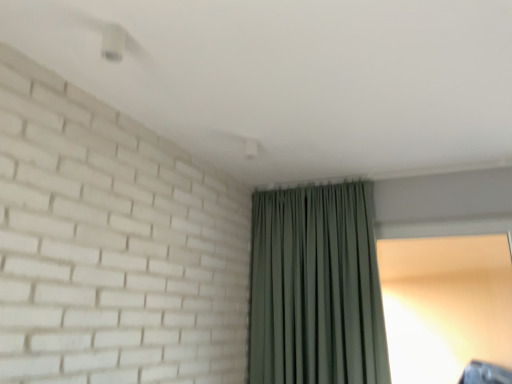
Where is `transparent glass window at right`? Image resolution: width=512 pixels, height=384 pixels. transparent glass window at right is located at coordinates (446, 305).

What do you see at coordinates (446, 305) in the screenshot?
I see `transparent glass window at right` at bounding box center [446, 305].

Image resolution: width=512 pixels, height=384 pixels. What do you see at coordinates (316, 288) in the screenshot?
I see `green fabric curtain at center` at bounding box center [316, 288].

You are a GUI agent. You are given a task and a screenshot of the screen. Output one action in this format:
    pyautogui.click(x=<x>, y=<y>)
    Task: Click on the green fabric curtain at center
    
    Given the screenshot: What is the action you would take?
    pyautogui.click(x=316, y=288)

This screenshot has width=512, height=384. Identify the location of transparent glass window at right. (446, 305).

Considering the positions of objects green fabric curtain at center and transparent glass window at right in the image provided, who is more to the right, green fabric curtain at center or transparent glass window at right?

transparent glass window at right is more to the right.

Is green fabric curtain at center positioned before transparent glass window at right?

Yes, green fabric curtain at center is closer to the camera.

Which is behind, point (333, 262) or point (465, 247)?

The point (465, 247) is behind.

From the image's perspective, which object appears higher, green fabric curtain at center or transparent glass window at right?

green fabric curtain at center is shown above in the image.

From a real-world perspective, is green fabric curtain at center physically below transparent glass window at right?

Actually, green fabric curtain at center is physically above transparent glass window at right in the real world.

Considering the sizes of green fabric curtain at center and transparent glass window at right in the image, is green fabric curtain at center wider or thinner than transparent glass window at right?

Considering their sizes, green fabric curtain at center looks broader than transparent glass window at right.

Is green fabric curtain at center shorter than transparent glass window at right?

In fact, green fabric curtain at center may be taller than transparent glass window at right.

Between green fabric curtain at center and transparent glass window at right, which one has larger size?

With larger size is green fabric curtain at center.

Does green fabric curtain at center contain transparent glass window at right?

Definitely not — transparent glass window at right is not inside green fabric curtain at center.

In the scene shown: Is green fabric curtain at center directly adjacent to transparent glass window at right?

green fabric curtain at center and transparent glass window at right are not in contact.

Is green fabric curtain at center looking in the opposite direction of transparent glass window at right?

No, green fabric curtain at center is not facing the opposite direction of transparent glass window at right.

How many degrees apart are the facing directions of green fabric curtain at center and transparent glass window at right?

The angle between the facing direction of green fabric curtain at center and the facing direction of transparent glass window at right is 0.631 degrees.

At what (x,y) coordinates should I click in order to perform the action: click on curtain above the transparent glass window at right (from a real-world perspective). Please return your answer as a coordinate pair (x, y). This screenshot has height=384, width=512. Looking at the image, I should click on (316, 288).

Looking at this image, which object is positioned more to the right, transparent glass window at right or green fabric curtain at center?

Positioned to the right is transparent glass window at right.

Considering the positions of objects transparent glass window at right and green fabric curtain at center in the image provided, who is in front, transparent glass window at right or green fabric curtain at center?

green fabric curtain at center.

Which is behind, point (445, 297) or point (270, 324)?

The point (270, 324) is farther from the camera.

From the image's perspective, is transparent glass window at right positioned above or below green fabric curtain at center?

transparent glass window at right is below green fabric curtain at center.

From a real-world perspective, between transparent glass window at right and green fabric curtain at center, who is vertically lower?

transparent glass window at right is physically lower.

Looking at this image, between transparent glass window at right and green fabric curtain at center, which one has smaller width?

transparent glass window at right.

In terms of height, does transparent glass window at right look taller or shorter compared to green fabric curtain at center?

Considering their sizes, transparent glass window at right has less height than green fabric curtain at center.

Who is smaller, transparent glass window at right or green fabric curtain at center?

Smaller between the two is transparent glass window at right.

Would you say transparent glass window at right is outside green fabric curtain at center?

Yes, transparent glass window at right is located beyond the bounds of green fabric curtain at center.

Is transparent glass window at right beside green fabric curtain at center?

There is a gap between transparent glass window at right and green fabric curtain at center.

Is transparent glass window at right facing towards green fabric curtain at center?

No, transparent glass window at right is not aimed at green fabric curtain at center.

What's the angular difference between transparent glass window at right and green fabric curtain at center's facing directions?

0.631 degrees.

Find the location of a particular element. This screenshot has height=384, width=512. window screen below the green fabric curtain at center (from the image's perspective) is located at coordinates tap(446, 305).

Identify the location of window screen behind the green fabric curtain at center. (446, 305).

Find the location of a particular element. This screenshot has width=512, height=384. window screen that is below the green fabric curtain at center (from the image's perspective) is located at coordinates (446, 305).